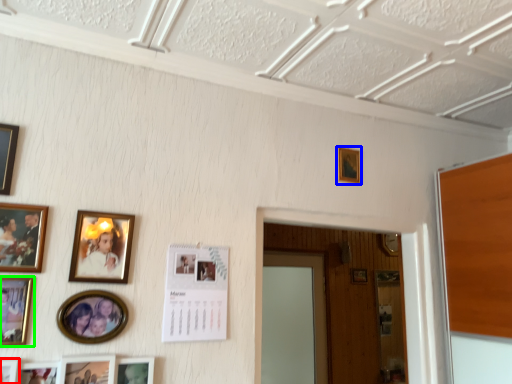
Question: Based on their relative distances, which object is nearer to picture frame (highlighted by a red box)? Choose from picture frame (highlighted by a blue box) and picture frame (highlighted by a green box).

Choices:
 (A) picture frame
 (B) picture frame

Answer: (B)